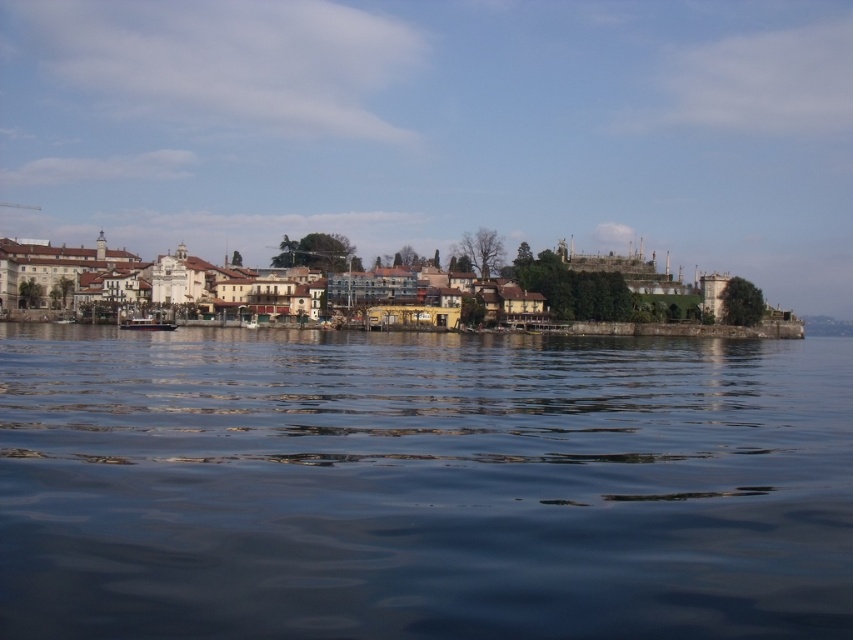
You are standing on a boat in the middle of the lake. You see the dark blue water at center and the multicolored wooden houses at center. Which object is closer to you?

The dark blue water at center is closer to you because it is positioned below the multicolored wooden houses at center, indicating that the water is in front of the houses from your perspective.

You are standing on the lakeshore and want to take a photo of the multicolored wooden houses at center and the metallic polished boat at center. Which object should you focus on first to ensure both are in clear view?

You should focus on the multicolored wooden houses at center first because it is closer to you than the metallic polished boat at center, ensuring both are in clear view.

You are standing at the point with coordinates (131, 330) and want to reach the point with coordinates (409, 320). Based on the scene description, which direction should you move to get there?

You should move north because point (409, 320) is behind point (131, 330), indicating it is in a northerly direction.